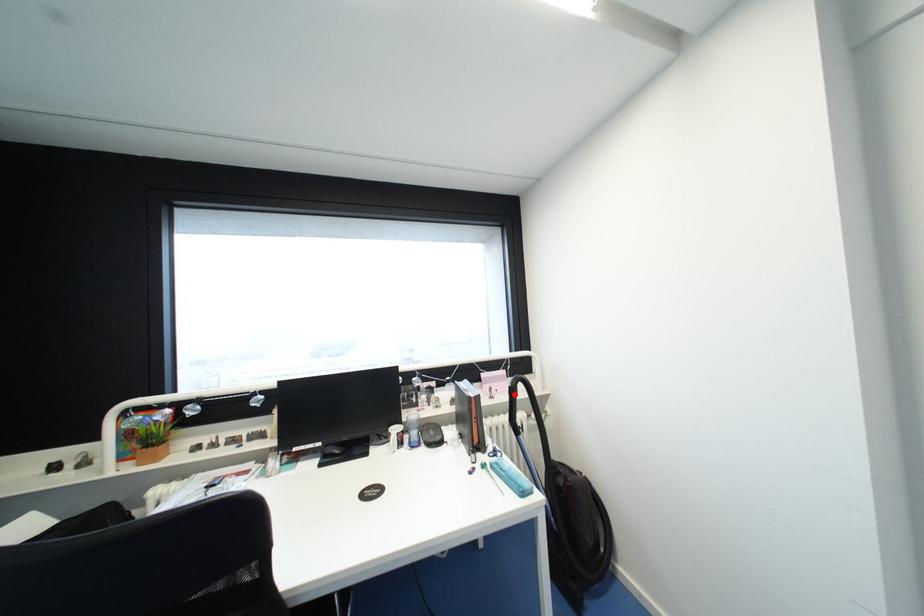
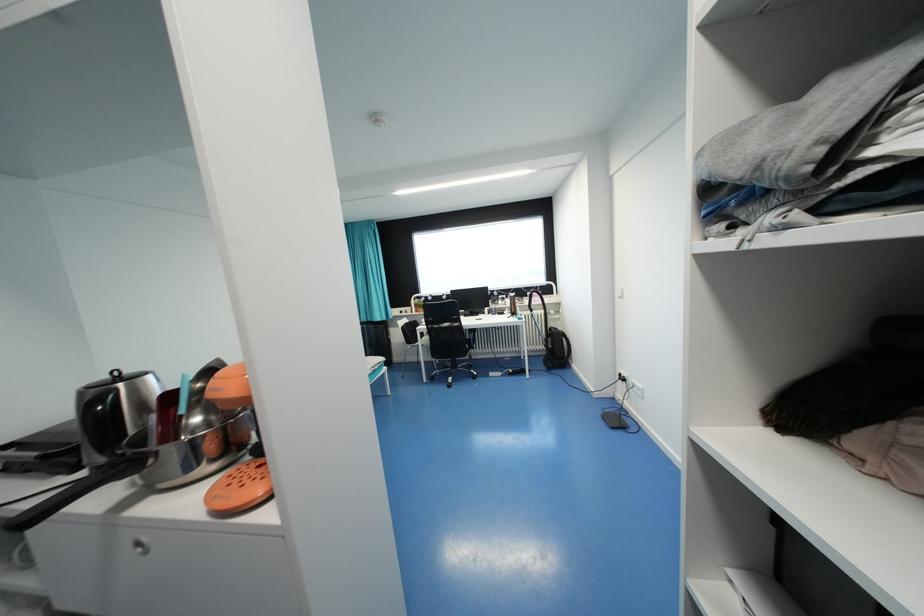
Locate, in the second image, the point that corresponds to the highlighted location in the first image.

(533, 298)